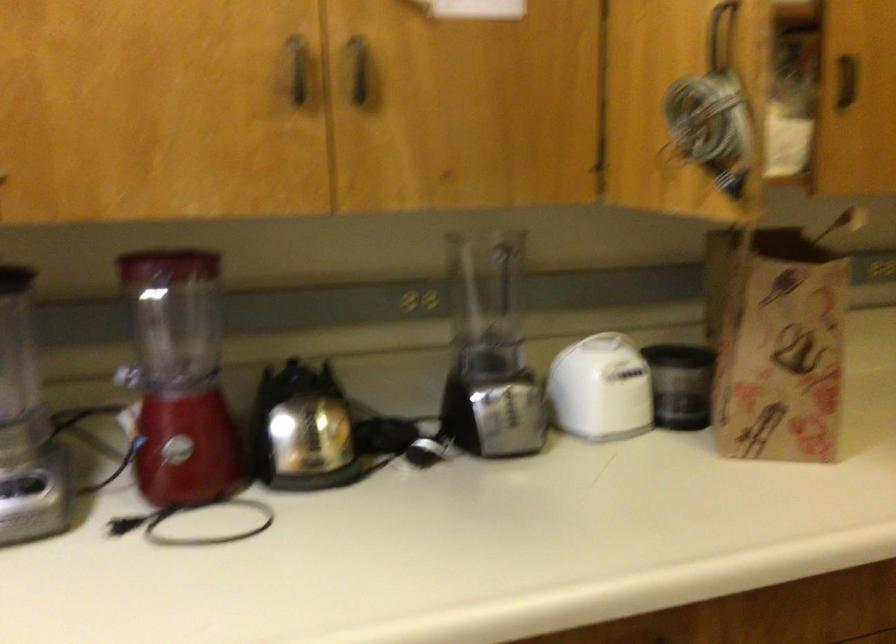
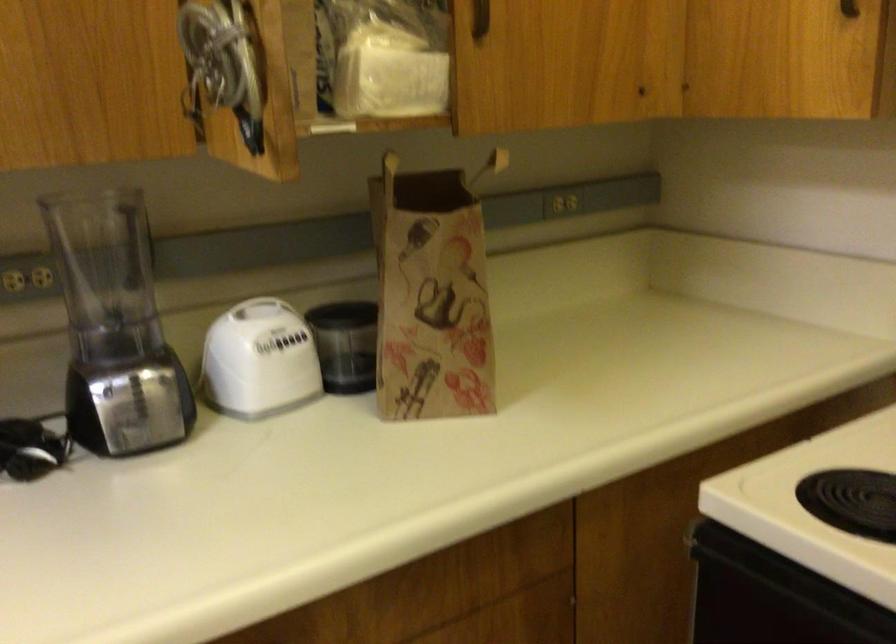
Find the pixel in the second image that matches point (796, 337) in the first image.

(431, 295)